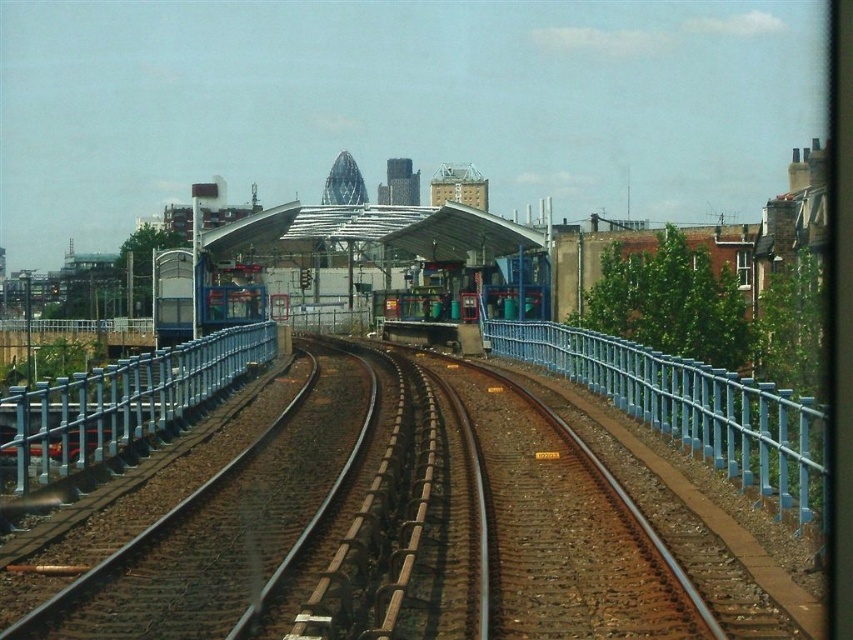
Question: Can you confirm if blue metallic rail at right is wider than transparent glass railway station at center?

Choices:
 (A) no
 (B) yes

Answer: (A)

Question: Which object is the closest to the metallic blue train at center?

Choices:
 (A) transparent glass railway station at center
 (B) blue metallic rail at right
 (C) metallic blue rail at center

Answer: (A)

Question: Which of the following is the farthest from the observer?

Choices:
 (A) blue metallic rail at right
 (B) metallic blue train at center
 (C) transparent glass railway station at center
 (D) metallic blue rail at center

Answer: (B)

Question: From the image, what is the correct spatial relationship of blue metallic rail at right in relation to metallic blue train at center?

Choices:
 (A) right
 (B) left

Answer: (A)

Question: Which point appears closest to the camera in this image?

Choices:
 (A) (437, 209)
 (B) (202, 326)

Answer: (B)

Question: Where is blue metallic rail at right located in relation to transparent glass railway station at center in the image?

Choices:
 (A) above
 (B) below

Answer: (B)